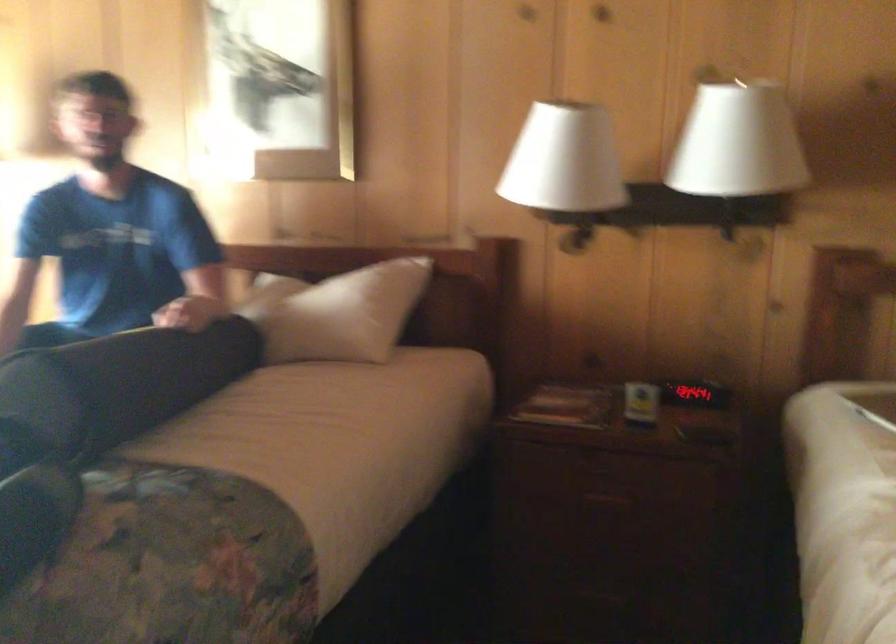
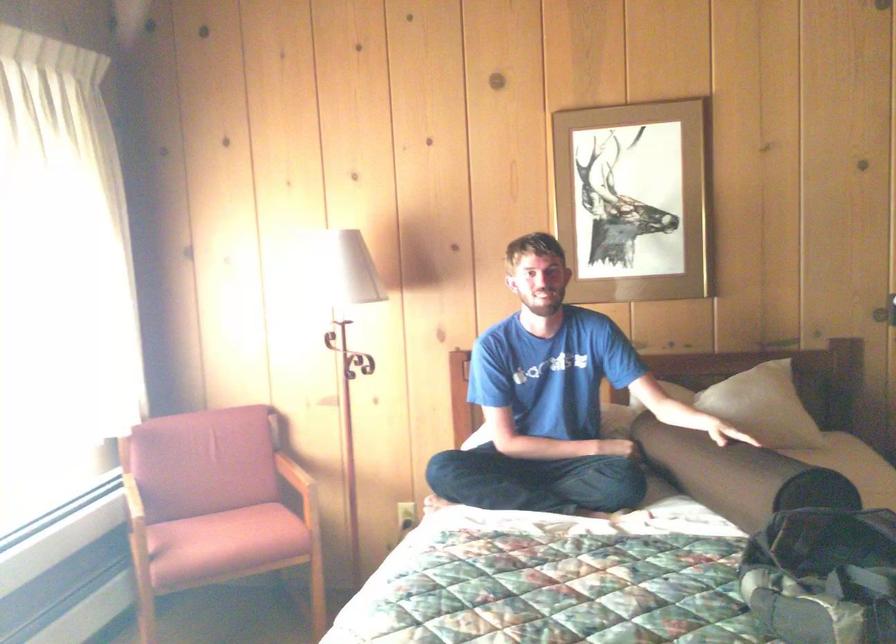
Locate, in the second image, the point that corresponds to (x=298, y=315) in the first image.

(762, 406)